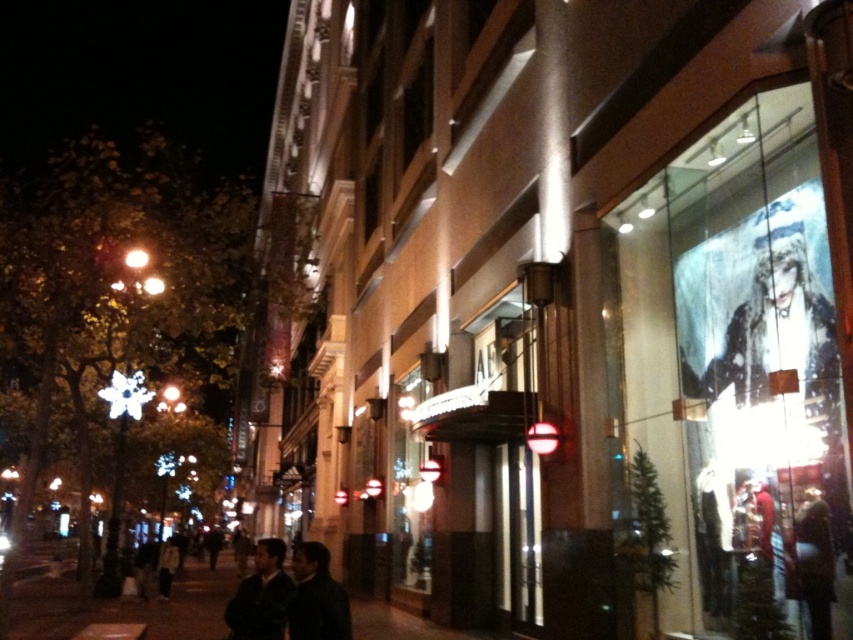
Does dark green leather jackets at center have a smaller size compared to dark gray jacket at center?

Correct, dark green leather jackets at center occupies less space than dark gray jacket at center.

In the scene shown: Is dark green leather jackets at center taller than dark gray jacket at center?

In fact, dark green leather jackets at center may be shorter than dark gray jacket at center.

Between point (315, 560) and point (343, 628), which one is positioned in front?

Point (343, 628) is more forward.

Where is `dark green leather jackets at center`? The image size is (853, 640). dark green leather jackets at center is located at coordinates (289, 596).

Who is more forward, (x=154, y=611) or (x=258, y=563)?

Point (x=258, y=563)

Is dark asphalt pavement at lower center below dark green leather jackets at center?

Correct, dark asphalt pavement at lower center is located below dark green leather jackets at center.

Image resolution: width=853 pixels, height=640 pixels. What do you see at coordinates (115, 602) in the screenshot? I see `dark asphalt pavement at lower center` at bounding box center [115, 602].

Locate an element on the screen. dark asphalt pavement at lower center is located at coordinates (115, 602).

Is dark asphalt pavement at lower center shorter than dark gray jacket at center?

Incorrect, dark asphalt pavement at lower center's height does not fall short of dark gray jacket at center's.

Can you confirm if dark asphalt pavement at lower center is bigger than dark gray jacket at center?

Indeed, dark asphalt pavement at lower center has a larger size compared to dark gray jacket at center.

Find the location of `dark asphalt pavement at lower center`. dark asphalt pavement at lower center is located at coordinates tap(115, 602).